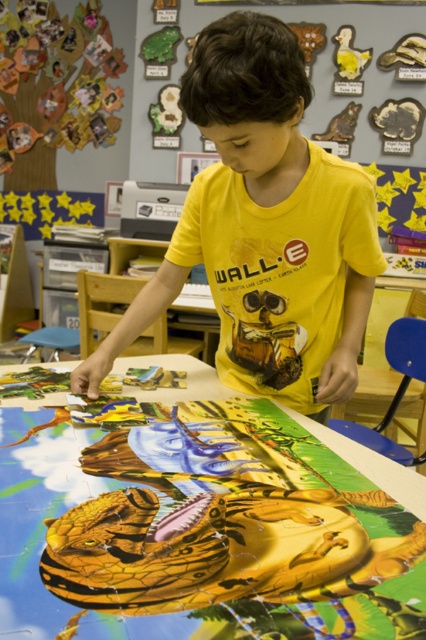
Can you confirm if yellow cotton shirt at center is smaller than wooden animal figures at upper center?

Yes.

Does point (333, 394) come in front of point (267, 10)?

Yes, point (333, 394) is in front of point (267, 10).

The height and width of the screenshot is (640, 426). Find the location of `yellow cotton shirt at center`. yellow cotton shirt at center is located at coordinates (264, 228).

Does wooden puzzle pieces at center appear on the right side of wooden animal figures at upper center?

In fact, wooden puzzle pieces at center is to the left of wooden animal figures at upper center.

Who is more forward, (164, 596) or (146, 108)?

Positioned in front is point (164, 596).

Between point (158, 624) and point (183, 131), which one is positioned behind?

The point (183, 131) is behind.

Locate an element on the screen. The height and width of the screenshot is (640, 426). wooden puzzle pieces at center is located at coordinates (198, 525).

Is wooden puzzle pieces at center to the left of yellow cotton shirt at center from the viewer's perspective?

Yes, wooden puzzle pieces at center is to the left of yellow cotton shirt at center.

Who is more distant from viewer, (78,579) or (339,337)?

Positioned behind is point (339,337).

Is point (178, 573) less distant than point (261, 100)?

That is True.

You are a GUI agent. You are given a task and a screenshot of the screen. Output one action in this format:
    pyautogui.click(x=<x>, y=<y>)
    Task: Click on the wooden puzzle pieces at center
    This screenshot has width=426, height=640.
    Given the screenshot: What is the action you would take?
    pyautogui.click(x=198, y=525)